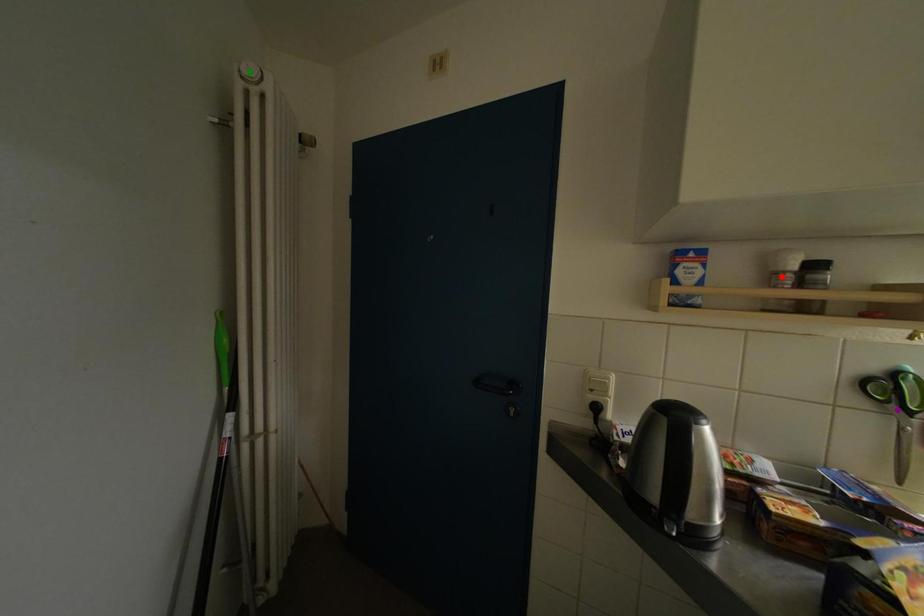
Order these from nearest to farthest:
- red point
- green point
- purple point

purple point, red point, green point